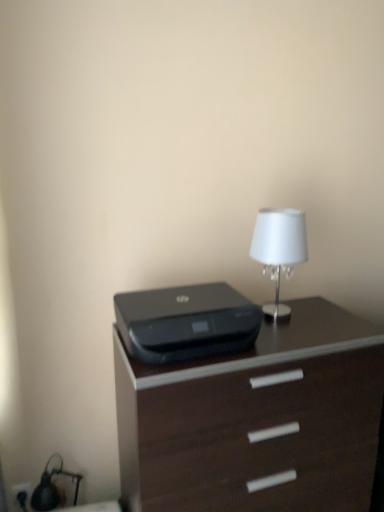
Question: From a real-world perspective, is black plastic printer at center positioned above or below dark wood chest of drawers at center?

Choices:
 (A) below
 (B) above

Answer: (B)

Question: From the image's perspective, is black plastic printer at center above or below dark wood chest of drawers at center?

Choices:
 (A) above
 (B) below

Answer: (A)

Question: In terms of width, does black plastic printer at center look wider or thinner when compared to dark wood chest of drawers at center?

Choices:
 (A) thin
 (B) wide

Answer: (A)

Question: Does point (167, 442) appear closer or farther from the camera than point (183, 326)?

Choices:
 (A) closer
 (B) farther

Answer: (A)

Question: Is dark wood chest of drawers at center taller or shorter than black plastic printer at center?

Choices:
 (A) tall
 (B) short

Answer: (A)

Question: Is dark wood chest of drawers at center to the left or to the right of black plastic printer at center in the image?

Choices:
 (A) left
 (B) right

Answer: (B)

Question: From the image's perspective, is dark wood chest of drawers at center above or below black plastic printer at center?

Choices:
 (A) above
 (B) below

Answer: (B)